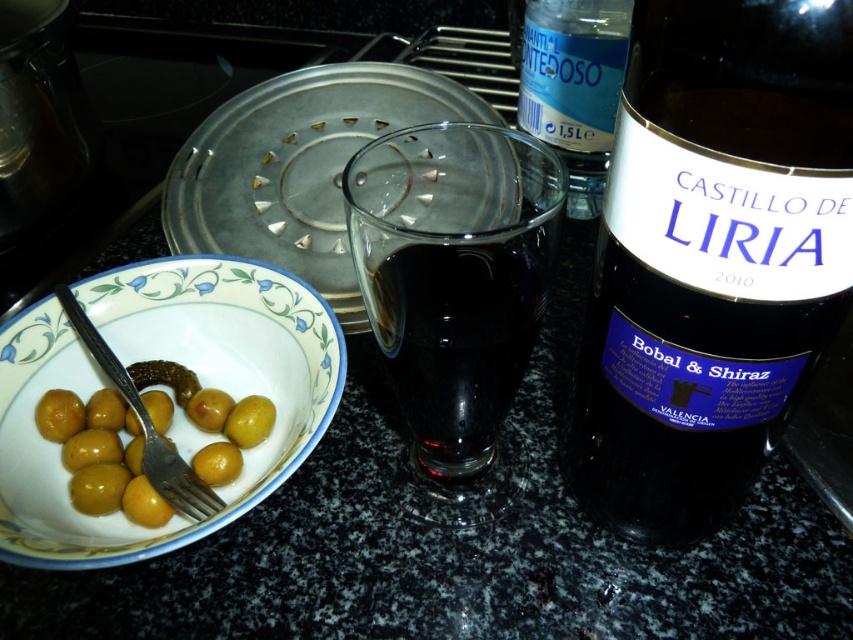
Based on the photo, you are setting up a dinner table and need to place a decorative item between the white glossy plate at lower left and the transparent plastic bottle at upper center. Based on their positions, where should you place the item to ensure it is equidistant from both?

The white glossy plate at lower left is below the transparent plastic bottle at upper center. To place an item equidistant between them, position it halfway between their vertical positions along the vertical axis since the plate is lower and the bottle is higher.

You are setting up a dinner table and have a dark glass bottle at right and a silver metallic fork at lower left. Which item takes up more space on the table?

The dark glass bottle at right is bigger than the silver metallic fork at lower left, so it takes up more space on the table.

You are setting up a dinner table and need to place a decorative item between the white glossy plate at lower left and the silver metallic fork at lower left. Which object should you place the item on top of to ensure it is visible over the other?

The white glossy plate at lower left has a greater height compared to the silver metallic fork at lower left, so placing the decorative item on top of the white glossy plate at lower left will ensure it is visible over the fork.